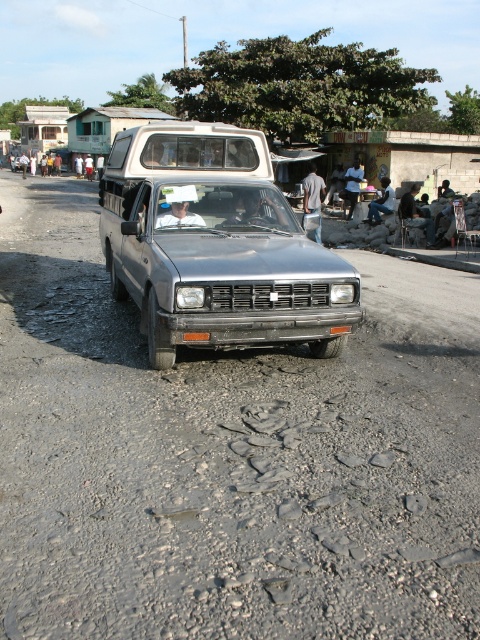
Describe the element at coordinates (216, 246) in the screenshot. I see `silver metallic pickup truck at center` at that location.

Between point (120, 196) and point (382, 179), which one is positioned in front?

Positioned in front is point (120, 196).

I want to click on silver metallic pickup truck at center, so click(216, 246).

What do you see at coordinates (416, 214) in the screenshot?
I see `dark gray fabric jacket at center` at bounding box center [416, 214].

Between dark gray fabric jacket at center and dark blue jeans at center, which one is positioned higher?

dark gray fabric jacket at center is above.

Locate an element on the screen. dark gray fabric jacket at center is located at coordinates (416, 214).

Is silver metallic pickup truck at center shorter than dark gray fabric jacket at center?

Indeed, silver metallic pickup truck at center has a lesser height compared to dark gray fabric jacket at center.

Which is above, silver metallic pickup truck at center or dark gray fabric jacket at center?

dark gray fabric jacket at center is above.

Which is behind, point (204, 179) or point (422, 224)?

The point (422, 224) is behind.

Where is `silver metallic pickup truck at center`? Image resolution: width=480 pixels, height=640 pixels. silver metallic pickup truck at center is located at coordinates (216, 246).